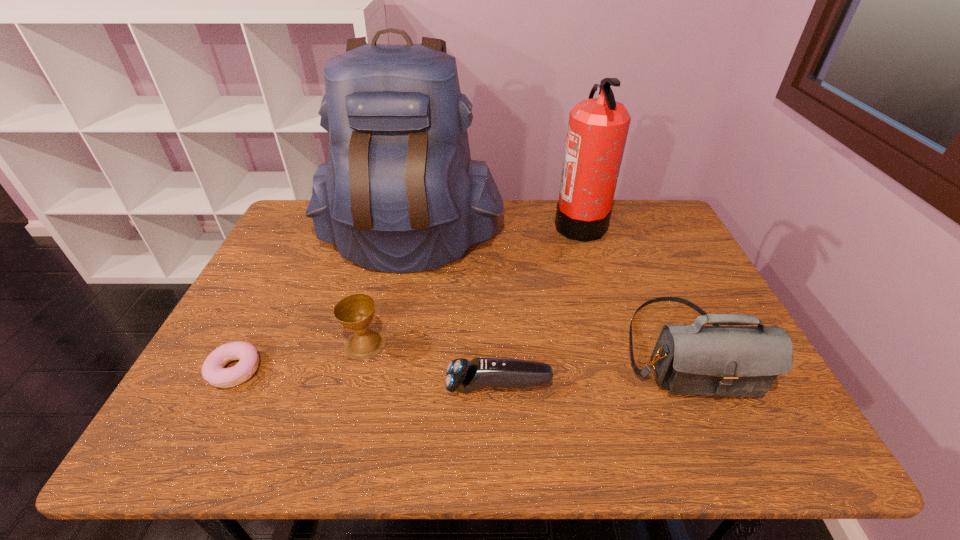
Locate an element on the screen. This screenshot has width=960, height=540. object at the right edge is located at coordinates (695, 359).

The height and width of the screenshot is (540, 960). Identify the location of object positioned at the far left corner. (399, 193).

What are the coordinates of `vacant region at the far edge of the desktop` in the screenshot? It's located at (623, 230).

The image size is (960, 540). Find the location of `vacant area at the left edge`. vacant area at the left edge is located at coordinates (248, 286).

Where is `vacant position at the right edge of the desktop`? vacant position at the right edge of the desktop is located at coordinates (686, 309).

In order to click on vacant space at the far right corner of the desktop in this screenshot , I will do `click(626, 228)`.

This screenshot has width=960, height=540. What are the coordinates of `free space between the electric shaver and the shortest object` in the screenshot? It's located at click(367, 379).

Identify the location of vacant region between the backpack and the fourth tallest object. This screenshot has width=960, height=540. (387, 292).

This screenshot has height=540, width=960. In order to click on empty space that is in between the chalice and the shortest object in this screenshot , I will do `click(300, 357)`.

Identify the location of free spot between the fifth tallest object and the shoulder bag. (591, 367).